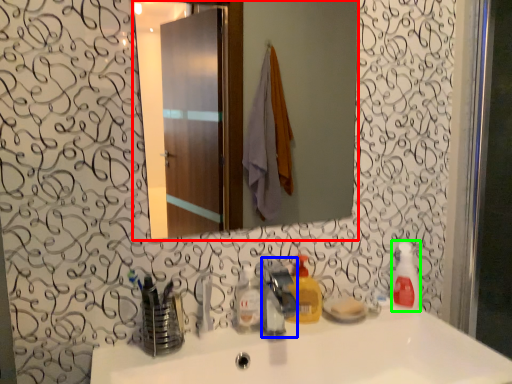
Question: Which object is the closest to the mirror (highlighted by a red box)? Choose among these: faucet (highlighted by a blue box) or soap dispenser (highlighted by a green box).

Choices:
 (A) faucet
 (B) soap dispenser

Answer: (B)